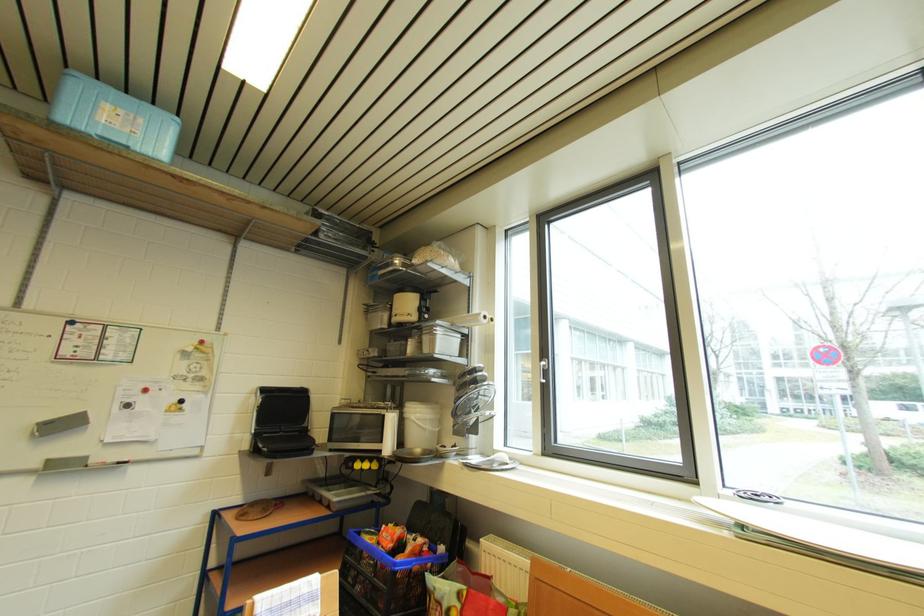
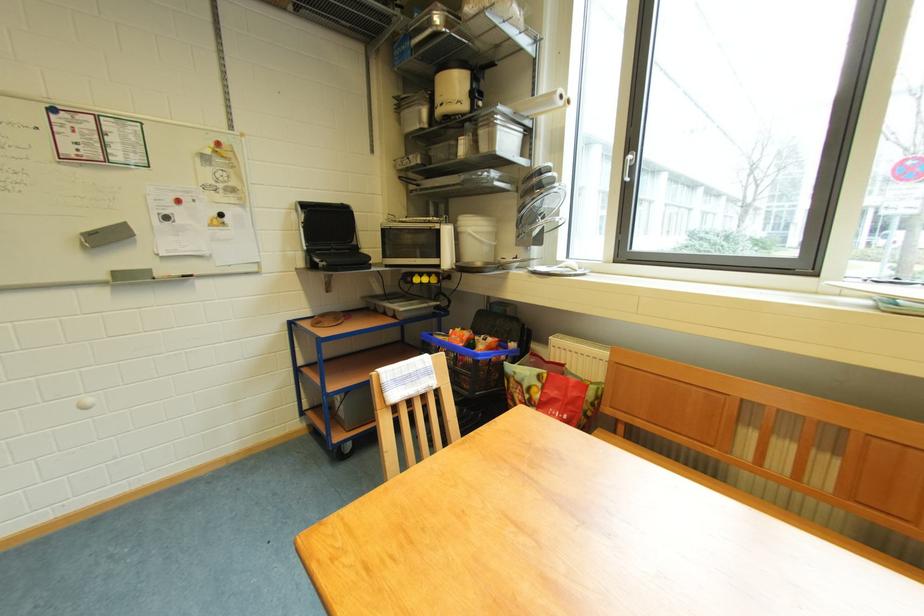
The point at [263,398] is marked in the first image. Where is the corresponding point in the second image?

(305, 214)